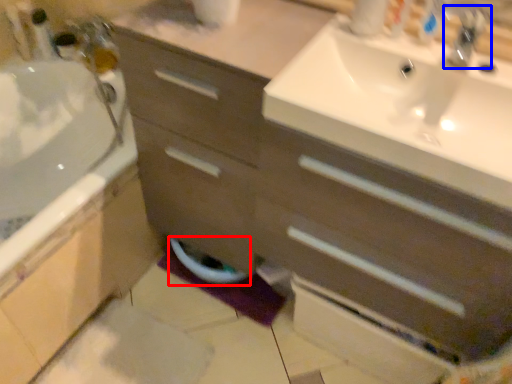
Question: Which object appears farthest to the camera in this image, toilet bowl (highlighted by a red box) or tap (highlighted by a blue box)?

Choices:
 (A) toilet bowl
 (B) tap

Answer: (A)